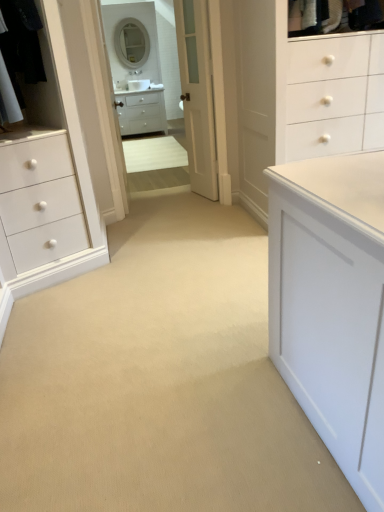
Measure the distance between point (113,17) and camera.

Point (113,17) and camera are 4.36 meters apart from each other.

How much space does white glossy mirror at upper center, which is the 1th mirror from bottom to top, occupy horizontally?

white glossy mirror at upper center, which is the 1th mirror from bottom to top, is 3.40 centimeters wide.

You are a GUI agent. You are given a task and a screenshot of the screen. Output one action in this format:
    pyautogui.click(x=<x>, y=<y>)
    Task: Click on the white glossy mirror at upper center, which is the second mirror in bottom-to-top order
    The height and width of the screenshot is (512, 384).
    Given the screenshot: What is the action you would take?
    pyautogui.click(x=132, y=42)

In the scene shown: How much space does white glossy mirror at upper center, which is the second mirror in bottom-to-top order, occupy vertically?

white glossy mirror at upper center, which is the second mirror in bottom-to-top order, is 86.27 centimeters tall.

Where is `black fabric laundry at upper left`? black fabric laundry at upper left is located at coordinates (22, 45).

Locate an element on the screen. white glossy mirror at upper center, the second mirror in the top-to-bottom sequence is located at coordinates (135, 66).

Is white glossy medicine cabinet at upper center facing away from white wood door at center?

That's right, white glossy medicine cabinet at upper center is facing away from white wood door at center.

Can you confirm if white glossy medicine cabinet at upper center is smaller than white wood door at center?

No, white glossy medicine cabinet at upper center is not smaller than white wood door at center.

Does point (106, 32) come behind point (207, 102)?

That is True.

In the scene shown: From a real-world perspective, is white glossy medicine cabinet at upper center physically located above or below white wood door at center?

In terms of real-world spatial position, white glossy medicine cabinet at upper center is below white wood door at center.

The image size is (384, 512). In order to click on medicine cabinet below the white wood door at center (from the image's perspective) in this screenshot , I will do [x=197, y=94].

Looking at this image, which is more to the right, white wood door at center or white glossy medicine cabinet at upper center?

white wood door at center is more to the right.

Does white wood door at center have a lesser height compared to white glossy medicine cabinet at upper center?

Yes.

Looking at this image, can you confirm if white wood door at center is wider than white glossy medicine cabinet at upper center?

Incorrect, the width of white wood door at center does not surpass that of white glossy medicine cabinet at upper center.

Where is `chest of drawers that is on the right side of white glossy mirror at upper center, the second mirror in the top-to-bottom sequence`? chest of drawers that is on the right side of white glossy mirror at upper center, the second mirror in the top-to-bottom sequence is located at coordinates tap(141, 111).

Which is more to the right, white glossy mirror at upper center, the second mirror in the top-to-bottom sequence, or white glossy cabinet at center?

From the viewer's perspective, white glossy cabinet at center appears more on the right side.

How many degrees apart are the facing directions of white glossy mirror at upper center, which is the 1th mirror from bottom to top, and white glossy cabinet at center?

The angle between the facing direction of white glossy mirror at upper center, which is the 1th mirror from bottom to top, and the facing direction of white glossy cabinet at center is 0.364 degrees.

From the picture: Considering the relative sizes of white glossy mirror at upper center, the second mirror in the top-to-bottom sequence, and white glossy cabinet at center in the image provided, is white glossy mirror at upper center, the second mirror in the top-to-bottom sequence, wider than white glossy cabinet at center?

No.

Which mirror is the 2nd one when counting from the left side of the white glossy cabinet at center? Please provide its 2D coordinates.

[(132, 42)]

Is white glossy mirror at upper center, which is the second mirror in bottom-to-top order, facing towards white glossy cabinet at center?

No, white glossy mirror at upper center, which is the second mirror in bottom-to-top order, is not oriented towards white glossy cabinet at center.

Does white glossy mirror at upper center, which appears as the first mirror when viewed from the top, appear on the right side of white glossy cabinet at center?

Incorrect, white glossy mirror at upper center, which appears as the first mirror when viewed from the top, is not on the right side of white glossy cabinet at center.

Can you confirm if white glossy mirror at upper center, which appears as the first mirror when viewed from the top, is taller than white glossy cabinet at center?

Yes, white glossy mirror at upper center, which appears as the first mirror when viewed from the top, is taller than white glossy cabinet at center.

Who is more distant, white glossy mirror at upper center, which is the 1th mirror from bottom to top, or white glossy mirror at upper center, which is the second mirror in bottom-to-top order?

Positioned behind is white glossy mirror at upper center, which is the second mirror in bottom-to-top order.

Does white glossy mirror at upper center, which is the 1th mirror from bottom to top, have a greater height compared to white glossy mirror at upper center, which appears as the first mirror when viewed from the top?

Correct, white glossy mirror at upper center, which is the 1th mirror from bottom to top, is much taller as white glossy mirror at upper center, which appears as the first mirror when viewed from the top.

Considering the relative sizes of white glossy mirror at upper center, the second mirror in the top-to-bottom sequence, and white glossy mirror at upper center, which appears as the first mirror when viewed from the top, in the image provided, is white glossy mirror at upper center, the second mirror in the top-to-bottom sequence, bigger than white glossy mirror at upper center, which appears as the first mirror when viewed from the top,?

Correct, white glossy mirror at upper center, the second mirror in the top-to-bottom sequence, is larger in size than white glossy mirror at upper center, which appears as the first mirror when viewed from the top.

Considering the relative sizes of white glossy mirror at upper center, which is the 1th mirror from bottom to top, and white glossy mirror at upper center, which appears as the first mirror when viewed from the top, in the image provided, is white glossy mirror at upper center, which is the 1th mirror from bottom to top, thinner than white glossy mirror at upper center, which appears as the first mirror when viewed from the top,?

Indeed, white glossy mirror at upper center, which is the 1th mirror from bottom to top, has a lesser width compared to white glossy mirror at upper center, which appears as the first mirror when viewed from the top.

Considering the sizes of objects white glossy medicine cabinet at upper center and white glossy mirror at upper center, which appears as the first mirror when viewed from the top, in the image provided, who is wider, white glossy medicine cabinet at upper center or white glossy mirror at upper center, which appears as the first mirror when viewed from the top,?

white glossy medicine cabinet at upper center.

Is point (203, 72) closer to viewer compared to point (133, 60)?

Yes, it is.

Is white glossy medicine cabinet at upper center closer to the viewer compared to white glossy mirror at upper center, which is the second mirror in bottom-to-top order?

Yes.

How different are the orientations of white glossy medicine cabinet at upper center and white glossy mirror at upper center, which appears as the first mirror when viewed from the top, in degrees?

The angular difference between white glossy medicine cabinet at upper center and white glossy mirror at upper center, which appears as the first mirror when viewed from the top, is 0.885 degrees.

Do you think white glossy mirror at upper center, the second mirror in the top-to-bottom sequence, is within black fabric laundry at upper left, or outside of it?

white glossy mirror at upper center, the second mirror in the top-to-bottom sequence, exists outside the volume of black fabric laundry at upper left.

Considering the relative positions of white glossy mirror at upper center, the second mirror in the top-to-bottom sequence, and black fabric laundry at upper left in the image provided, is white glossy mirror at upper center, the second mirror in the top-to-bottom sequence, to the left of black fabric laundry at upper left from the viewer's perspective?

Indeed, white glossy mirror at upper center, the second mirror in the top-to-bottom sequence, is positioned on the left side of black fabric laundry at upper left.

Does point (140, 131) lie in front of point (35, 54)?

No, (140, 131) is further to viewer.

Based on the photo, which of these two, white glossy mirror at upper center, which is the 1th mirror from bottom to top, or black fabric laundry at upper left, is wider?

black fabric laundry at upper left is wider.

The height and width of the screenshot is (512, 384). In the image, there is a white glossy medicine cabinet at upper center. Identify the location of door above it (from the image's perspective). (197, 94).

The height and width of the screenshot is (512, 384). What are the coordinates of `medicine cabinet that appears on the left of white wood door at center` in the screenshot? It's located at pyautogui.click(x=197, y=94).

Based on their spatial positions, is white glossy mirror at upper center, which appears as the first mirror when viewed from the top, or white wood door at center further from white glossy cabinet at center?

Among the two, white wood door at center is located further to white glossy cabinet at center.

Considering their positions, is white glossy medicine cabinet at upper center positioned further to white glossy mirror at upper center, the second mirror in the top-to-bottom sequence, than white glossy cabinet at center?

The object further to white glossy mirror at upper center, the second mirror in the top-to-bottom sequence, is white glossy medicine cabinet at upper center.

Considering their positions, is black fabric laundry at upper left positioned further to white glossy mirror at upper center, which appears as the first mirror when viewed from the top, than white glossy mirror at upper center, the second mirror in the top-to-bottom sequence?

black fabric laundry at upper left lies further to white glossy mirror at upper center, which appears as the first mirror when viewed from the top, than the other object.

Estimate the real-world distances between objects in this image. Which object is further from white glossy medicine cabinet at upper center, white glossy mirror at upper center, which appears as the first mirror when viewed from the top, or black fabric laundry at upper left?

white glossy mirror at upper center, which appears as the first mirror when viewed from the top, lies further to white glossy medicine cabinet at upper center than the other object.

Considering their positions, is white glossy mirror at upper center, which appears as the first mirror when viewed from the top, positioned closer to white glossy medicine cabinet at upper center than white glossy mirror at upper center, the second mirror in the top-to-bottom sequence?

white glossy mirror at upper center, the second mirror in the top-to-bottom sequence, lies closer to white glossy medicine cabinet at upper center than the other object.

Based on the photo, estimate the real-world distances between objects in this image. Which object is further from white glossy mirror at upper center, which appears as the first mirror when viewed from the top, white glossy mirror at upper center, which is the 1th mirror from bottom to top, or white glossy cabinet at center?

white glossy cabinet at center lies further to white glossy mirror at upper center, which appears as the first mirror when viewed from the top, than the other object.

Which object lies further to the anchor point white glossy mirror at upper center, the second mirror in the top-to-bottom sequence, white glossy cabinet at center or white glossy medicine cabinet at upper center?

white glossy medicine cabinet at upper center lies further to white glossy mirror at upper center, the second mirror in the top-to-bottom sequence, than the other object.

Which object lies further to the anchor point white glossy cabinet at center, black fabric laundry at upper left or white glossy mirror at upper center, which is the second mirror in bottom-to-top order?

Among the two, black fabric laundry at upper left is located further to white glossy cabinet at center.

Find the location of `mirror between white glossy medicine cabinet at upper center and white glossy mirror at upper center, which is the second mirror in bottom-to-top order, in the front-back direction`. mirror between white glossy medicine cabinet at upper center and white glossy mirror at upper center, which is the second mirror in bottom-to-top order, in the front-back direction is located at coordinates (135, 66).

Find the location of a particular element. The image size is (384, 512). door between white glossy medicine cabinet at upper center and white glossy mirror at upper center, which appears as the first mirror when viewed from the top, in the front-back direction is located at coordinates (197, 94).

Where is `door located between white glossy medicine cabinet at upper center and white glossy cabinet at center in the depth direction`? door located between white glossy medicine cabinet at upper center and white glossy cabinet at center in the depth direction is located at coordinates (197, 94).

At what (x,y) coordinates should I click in order to perform the action: click on mirror between black fabric laundry at upper left and white glossy mirror at upper center, which is the second mirror in bottom-to-top order, in the front-back direction. Please return your answer as a coordinate pair (x, y). Looking at the image, I should click on (135, 66).